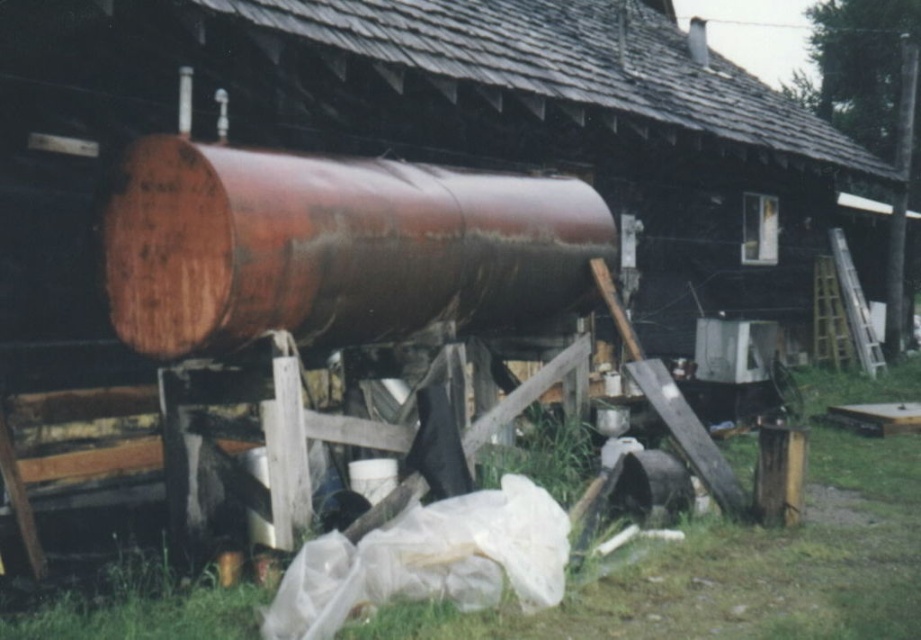
You are standing in this outdoor area and want to step onto the green grass at lower center. Is the rusty metal barrel at center blocking your path?

The rusty metal barrel at center is further to the viewer than green grass at lower center, so it is closer to you. This means the barrel is between you and the grass, blocking your path.

You are standing at the center of the image. Which object is located at coordinates point (335, 248)?

The point (335, 248) marks the location of the rusty metal barrel at center.

You are standing in front of the large cylindrical tank on the wooden platform. There are two points marked in the scene, one at coordinates point [545,266] and the other at point [118,568]. Which point is closer to you?

Point [118,568] is closer to you because it is less further to the camera than point [545,266].